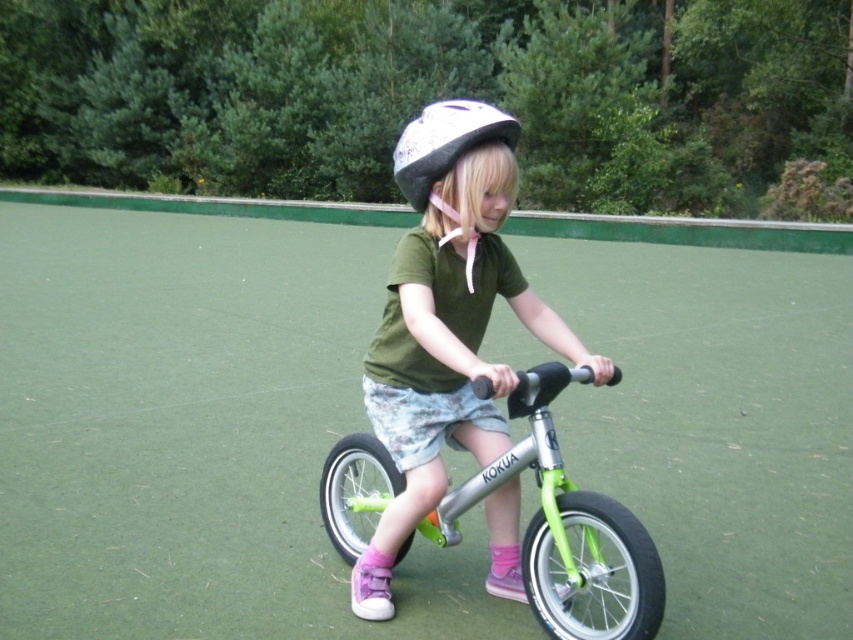
Question: Can you confirm if green metallic bicycle at center is bigger than white matte helmet at center?

Choices:
 (A) no
 (B) yes

Answer: (A)

Question: From the image, what is the correct spatial relationship of matte silver helmet at center in relation to white matte helmet at center?

Choices:
 (A) left
 (B) right

Answer: (B)

Question: Does green metallic bicycle at center appear under white matte helmet at center?

Choices:
 (A) yes
 (B) no

Answer: (A)

Question: Which point appears closest to the camera in this image?

Choices:
 (A) (489, 408)
 (B) (427, 113)
 (C) (566, 589)

Answer: (B)

Question: Which point appears farthest from the camera in this image?

Choices:
 (A) (436, 122)
 (B) (529, 548)
 (C) (432, 253)

Answer: (C)

Question: Which point is closer to the camera taking this photo?

Choices:
 (A) (511, 387)
 (B) (425, 180)
 (C) (558, 563)

Answer: (A)